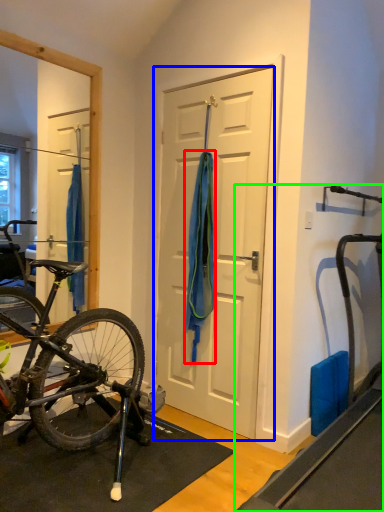
Question: Based on their relative distances, which object is farther from towel/napkin (highlighted by a red box)? Choose from door (highlighted by a blue box) and treadmill (highlighted by a green box).

Choices:
 (A) door
 (B) treadmill

Answer: (B)